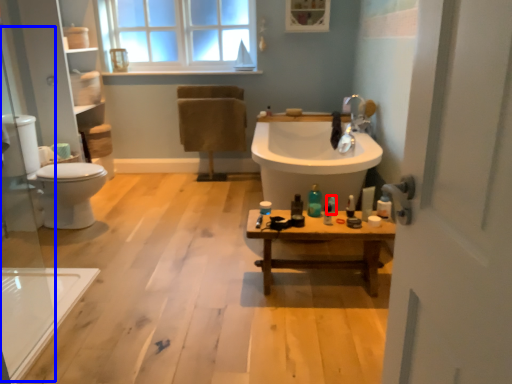
Question: Which of the following is the closest to the observer, toiletry (highlighted by a red box) or glass door (highlighted by a blue box)?

Choices:
 (A) toiletry
 (B) glass door

Answer: (B)